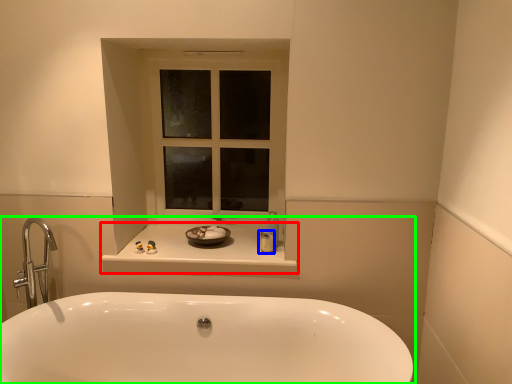
Question: Based on their relative distances, which object is farther from counter top (highlighted by a red box)? Choose from toiletry (highlighted by a blue box) and bathtub (highlighted by a green box).

Choices:
 (A) toiletry
 (B) bathtub

Answer: (B)